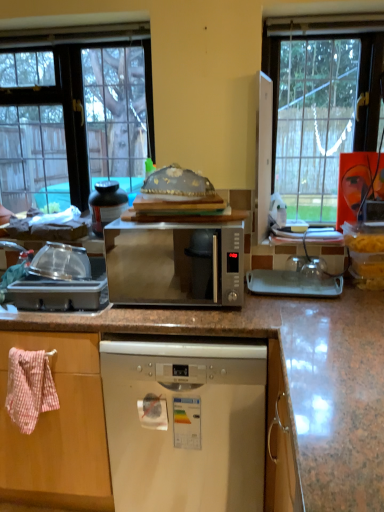
Question: From a real-world perspective, is clear glass window at upper left physically below clear plastic container at left, the first appliance viewed from the front?

Choices:
 (A) no
 (B) yes

Answer: (A)

Question: Is clear plastic container at left, the first appliance viewed from the front, at the back of clear glass window at upper left?

Choices:
 (A) no
 (B) yes

Answer: (A)

Question: Considering the relative sizes of clear glass window at upper left and clear plastic container at left, the second appliance viewed from the back, in the image provided, is clear glass window at upper left wider than clear plastic container at left, the second appliance viewed from the back,?

Choices:
 (A) yes
 (B) no

Answer: (B)

Question: Is clear glass window at upper left to the right of clear plastic container at left, the 2th appliance from the top, from the viewer's perspective?

Choices:
 (A) no
 (B) yes

Answer: (A)

Question: Is clear glass window at upper left further to the viewer compared to clear plastic container at left, which ranks as the first appliance in bottom-to-top order?

Choices:
 (A) no
 (B) yes

Answer: (B)

Question: Does clear glass window at upper left turn towards clear plastic container at left, which ranks as the first appliance in bottom-to-top order?

Choices:
 (A) yes
 (B) no

Answer: (A)

Question: Is satin silver microwave at center aimed at clear glass window at upper left?

Choices:
 (A) no
 (B) yes

Answer: (A)

Question: From a real-world perspective, is satin silver microwave at center beneath clear glass window at upper left?

Choices:
 (A) yes
 (B) no

Answer: (A)

Question: Can you confirm if satin silver microwave at center is wider than clear glass window at upper left?

Choices:
 (A) no
 (B) yes

Answer: (B)

Question: From a real-world perspective, is satin silver microwave at center positioned over clear glass window at upper left based on gravity?

Choices:
 (A) yes
 (B) no

Answer: (B)

Question: Considering the relative sizes of satin silver microwave at center and clear glass window at upper left in the image provided, is satin silver microwave at center taller than clear glass window at upper left?

Choices:
 (A) yes
 (B) no

Answer: (B)

Question: Is satin silver microwave at center far from clear glass window at upper left?

Choices:
 (A) no
 (B) yes

Answer: (A)

Question: Would you say satin silver microwave at center is outside pink woven towel at left?

Choices:
 (A) no
 (B) yes

Answer: (B)